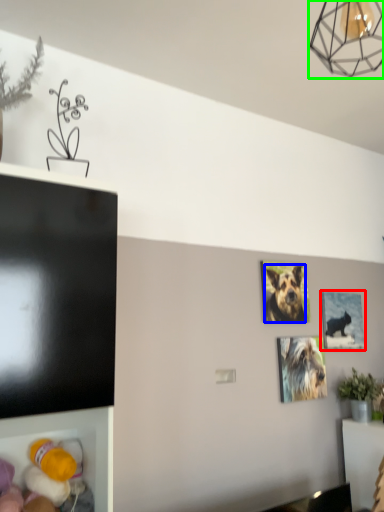
Question: Estimate the real-world distances between objects in this image. Which object is closer to picture frame (highlighted by a red box), dog (highlighted by a blue box) or lamp (highlighted by a green box)?

Choices:
 (A) dog
 (B) lamp

Answer: (A)